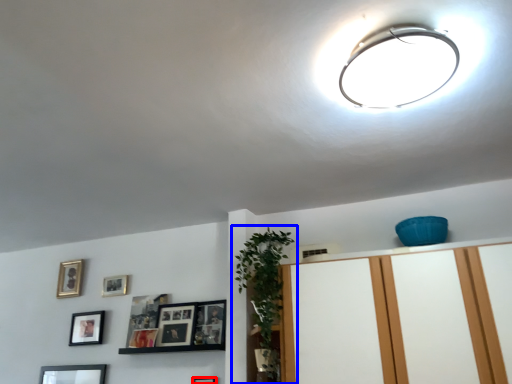
Question: Which object appears farthest to the camera in this image, picture frame (highlighted by a red box) or houseplant (highlighted by a blue box)?

Choices:
 (A) picture frame
 (B) houseplant

Answer: (A)